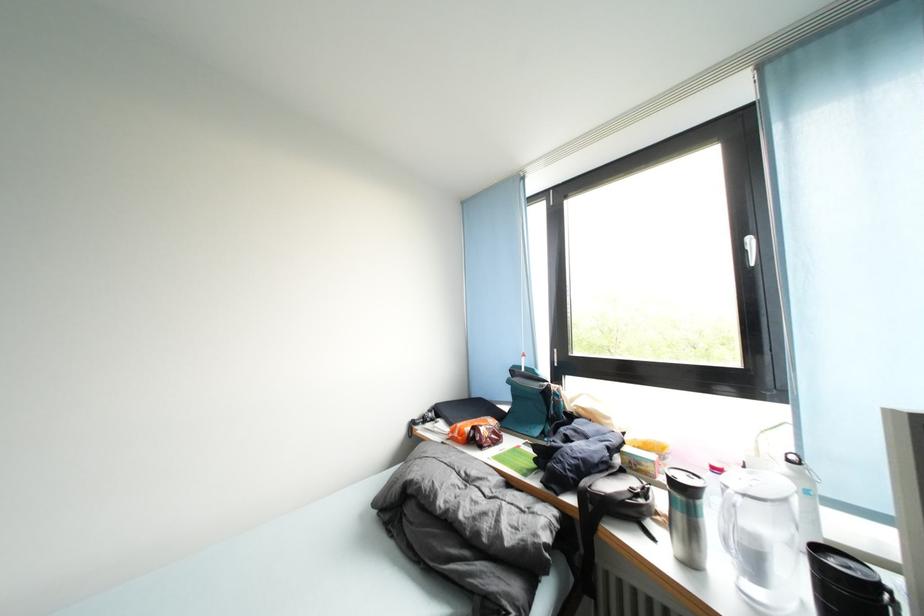
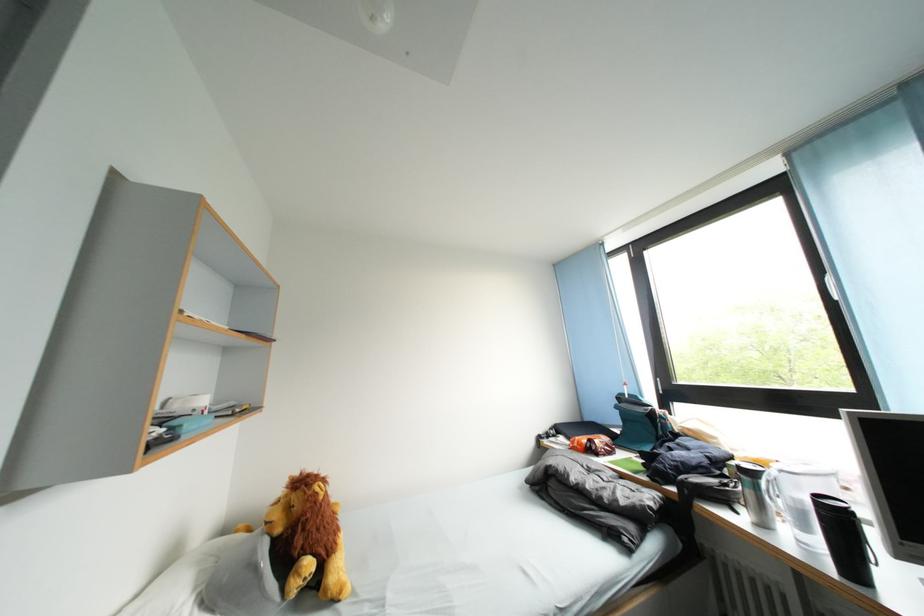
Question: In a continuous first-person perspective shot, in which direction is the camera moving?

Choices:
 (A) Left
 (B) Right
 (C) Forward
 (D) Backward

Answer: (D)